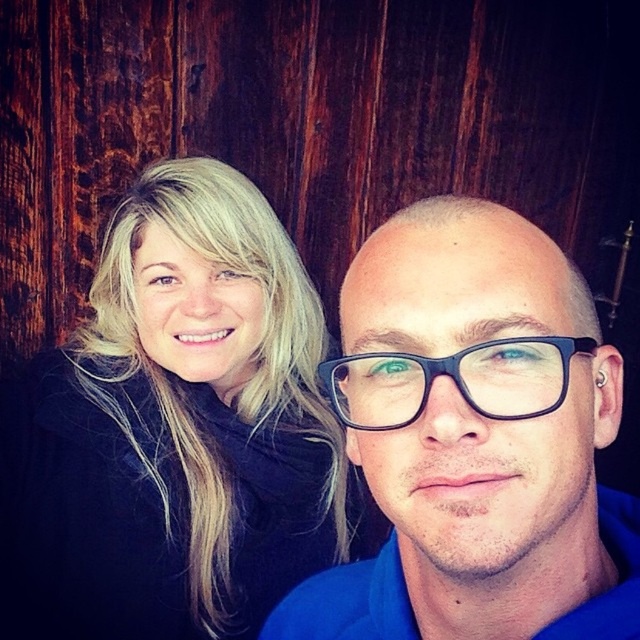
Question: Does blonde hair at upper left appear over blue matte glasses at center?

Choices:
 (A) no
 (B) yes

Answer: (B)

Question: Which point appears closest to the camera in this image?

Choices:
 (A) (513, 380)
 (B) (381, 481)
 (C) (144, 573)

Answer: (A)

Question: Among these objects, which one is nearest to the camera?

Choices:
 (A) black plastic glasses at center
 (B) blue matte glasses at center
 (C) blonde hair at upper left

Answer: (B)

Question: Is blonde hair at upper left behind black plastic glasses at center?

Choices:
 (A) no
 (B) yes

Answer: (B)

Question: Which of these objects is positioned farthest from the black plastic glasses at center?

Choices:
 (A) blonde hair at upper left
 (B) blue matte glasses at center

Answer: (A)

Question: Does blonde hair at upper left have a smaller size compared to blue matte glasses at center?

Choices:
 (A) no
 (B) yes

Answer: (A)